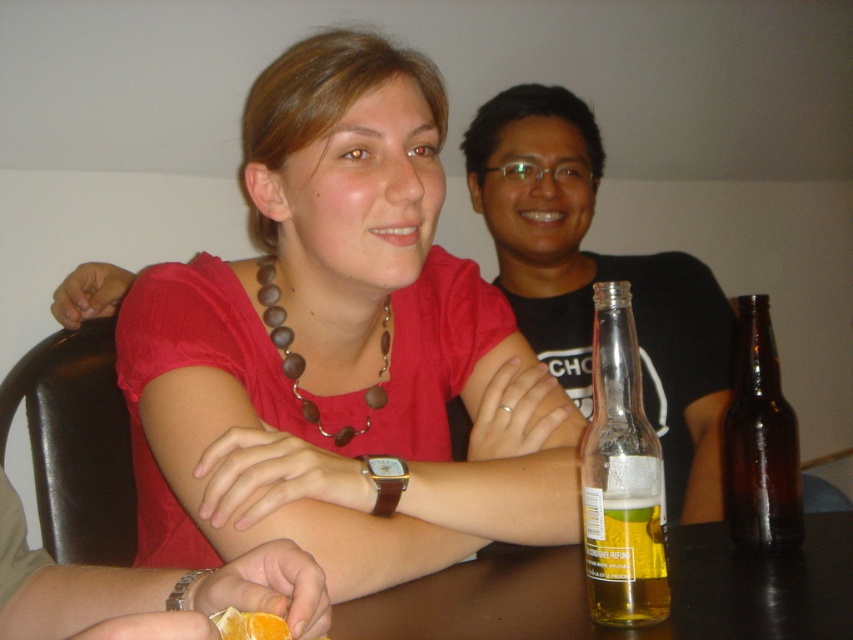
Question: Does matte red shirt at center have a greater width compared to brown wooden beads at center?

Choices:
 (A) yes
 (B) no

Answer: (A)

Question: Where is matte red shirt at center located in relation to orange peel at lower center in the image?

Choices:
 (A) above
 (B) below

Answer: (A)

Question: Estimate the real-world distances between objects in this image. Which object is closer to the orange peel at lower center?

Choices:
 (A) brown glass bottle at right
 (B) brown wooden table at lower center

Answer: (B)

Question: Which object is farther from the camera taking this photo?

Choices:
 (A) brown glass bottle at right
 (B) brown wooden beads at center

Answer: (B)

Question: Which point is closer to the camera?

Choices:
 (A) clear glass bottle at center
 (B) brown wooden table at lower center
 (C) orange peel at lower center
 (D) matte red shirt at center

Answer: (C)

Question: Is brown wooden beads at center in front of orange peel at lower center?

Choices:
 (A) no
 (B) yes

Answer: (A)